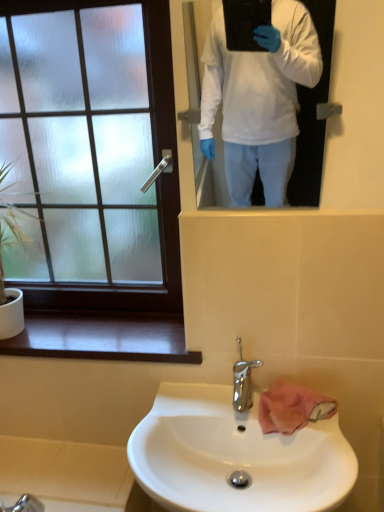
Find the location of a particular element. vacant space in front of frosted glass window at upper left is located at coordinates (88, 339).